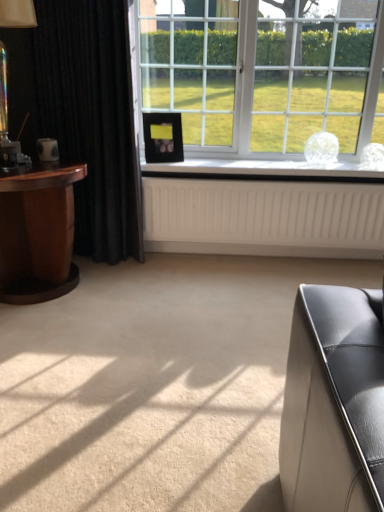
Question: Is clear glass window at center in front of translucent glass table lamp at left?

Choices:
 (A) no
 (B) yes

Answer: (A)

Question: Can you confirm if clear glass window at center is taller than translucent glass table lamp at left?

Choices:
 (A) no
 (B) yes

Answer: (B)

Question: Considering the relative sizes of clear glass window at center and translucent glass table lamp at left in the image provided, is clear glass window at center smaller than translucent glass table lamp at left?

Choices:
 (A) no
 (B) yes

Answer: (A)

Question: Would you say clear glass window at center contains translucent glass table lamp at left?

Choices:
 (A) no
 (B) yes

Answer: (A)

Question: Is clear glass window at center thinner than translucent glass table lamp at left?

Choices:
 (A) yes
 (B) no

Answer: (A)

Question: From a real-world perspective, is black matte picture frame at center positioned above or below mahogany wood side table at left?

Choices:
 (A) below
 (B) above

Answer: (B)

Question: In terms of width, does black matte picture frame at center look wider or thinner when compared to mahogany wood side table at left?

Choices:
 (A) wide
 (B) thin

Answer: (B)

Question: Is black matte picture frame at center spatially inside mahogany wood side table at left, or outside of it?

Choices:
 (A) outside
 (B) inside

Answer: (A)

Question: Considering the relative positions of black matte picture frame at center and mahogany wood side table at left in the image provided, is black matte picture frame at center to the left or to the right of mahogany wood side table at left?

Choices:
 (A) right
 (B) left

Answer: (A)

Question: From a real-world perspective, is black matte picture frame at center positioned above or below translucent glass table lamp at left?

Choices:
 (A) above
 (B) below

Answer: (B)

Question: Is black matte picture frame at center in front of or behind translucent glass table lamp at left in the image?

Choices:
 (A) front
 (B) behind

Answer: (B)

Question: From the image's perspective, is black matte picture frame at center located above or below translucent glass table lamp at left?

Choices:
 (A) above
 (B) below

Answer: (B)

Question: Considering the positions of black matte picture frame at center and translucent glass table lamp at left in the image, is black matte picture frame at center wider or thinner than translucent glass table lamp at left?

Choices:
 (A) thin
 (B) wide

Answer: (A)

Question: Based on their sizes in the image, would you say clear glass window at center is bigger or smaller than clear glass vase at center?

Choices:
 (A) small
 (B) big

Answer: (B)

Question: Considering the positions of point (375, 18) and point (345, 167), is point (375, 18) closer or farther from the camera than point (345, 167)?

Choices:
 (A) closer
 (B) farther

Answer: (A)